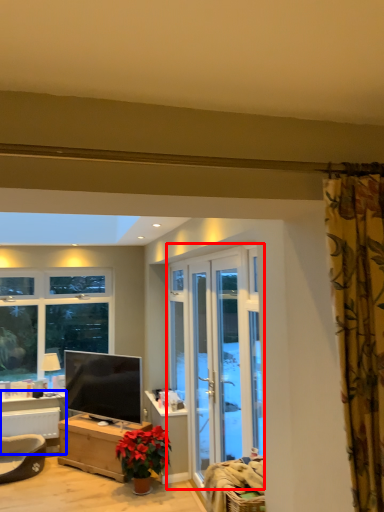
Question: Which of the following is the closest to the observer, screen door (highlighted by a red box) or table (highlighted by a blue box)?

Choices:
 (A) screen door
 (B) table

Answer: (A)